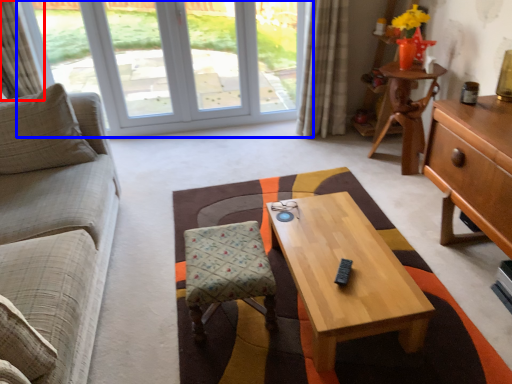
Question: Among these objects, which one is nearest to the camera, curtain (highlighted by a red box) or window (highlighted by a blue box)?

Choices:
 (A) curtain
 (B) window

Answer: (A)